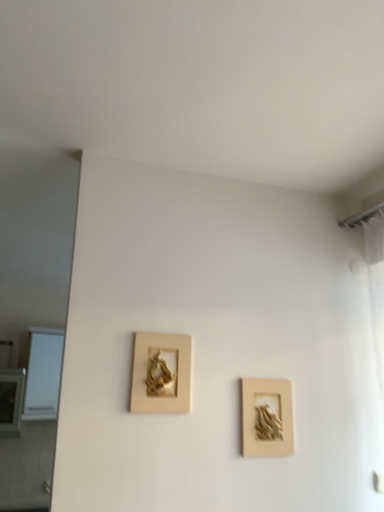
Question: In which direction should I rotate to look at matte gold picture frame at center, arranged as the 2th picture frame when viewed from the right?

Choices:
 (A) left
 (B) right

Answer: (A)

Question: Can you confirm if matte gold picture frame at center, arranged as the 2th picture frame when viewed from the right, is smaller than beige matte picture frame at center-right, which ranks as the 1th picture frame in right-to-left order?

Choices:
 (A) yes
 (B) no

Answer: (B)

Question: Is matte gold picture frame at center, arranged as the 2th picture frame when viewed from the right, not inside beige matte picture frame at center-right, which is the 2th picture frame in left-to-right order?

Choices:
 (A) no
 (B) yes

Answer: (B)

Question: Is matte gold picture frame at center, acting as the first picture frame starting from the left, facing towards beige matte picture frame at center-right, which ranks as the 1th picture frame in right-to-left order?

Choices:
 (A) no
 (B) yes

Answer: (A)

Question: Is matte gold picture frame at center, acting as the first picture frame starting from the left, shorter than beige matte picture frame at center-right, which ranks as the 1th picture frame in right-to-left order?

Choices:
 (A) no
 (B) yes

Answer: (B)

Question: Is matte gold picture frame at center, acting as the first picture frame starting from the left, turned away from beige matte picture frame at center-right, which ranks as the 1th picture frame in right-to-left order?

Choices:
 (A) yes
 (B) no

Answer: (B)

Question: Can you confirm if matte gold picture frame at center, arranged as the 2th picture frame when viewed from the right, is taller than beige matte picture frame at center-right, which is the 2th picture frame in left-to-right order?

Choices:
 (A) yes
 (B) no

Answer: (B)

Question: Does beige matte picture frame at center-right, which ranks as the 1th picture frame in right-to-left order, appear on the left side of white glass window at left?

Choices:
 (A) no
 (B) yes

Answer: (A)

Question: From a real-world perspective, is beige matte picture frame at center-right, which is the 2th picture frame in left-to-right order, below white glass window at left?

Choices:
 (A) no
 (B) yes

Answer: (B)

Question: Does beige matte picture frame at center-right, which ranks as the 1th picture frame in right-to-left order, have a smaller size compared to white glass window at left?

Choices:
 (A) no
 (B) yes

Answer: (B)

Question: Does beige matte picture frame at center-right, which ranks as the 1th picture frame in right-to-left order, have a greater width compared to white glass window at left?

Choices:
 (A) no
 (B) yes

Answer: (A)

Question: Is beige matte picture frame at center-right, which ranks as the 1th picture frame in right-to-left order, touching white glass window at left?

Choices:
 (A) yes
 (B) no

Answer: (B)

Question: Is beige matte picture frame at center-right, which ranks as the 1th picture frame in right-to-left order, at the right side of white glass window at left?

Choices:
 (A) no
 (B) yes

Answer: (B)

Question: From the image's perspective, is matte gold picture frame at center, arranged as the 2th picture frame when viewed from the right, below white glass window at left?

Choices:
 (A) no
 (B) yes

Answer: (A)